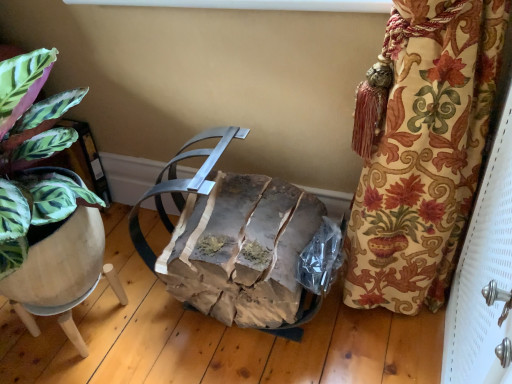
This screenshot has height=384, width=512. Describe the element at coordinates (233, 240) in the screenshot. I see `wooden textured swivel chair at center` at that location.

I want to click on wooden textured swivel chair at center, so coord(233,240).

Where is `wooden textured swivel chair at center`? This screenshot has height=384, width=512. wooden textured swivel chair at center is located at coordinates (233, 240).